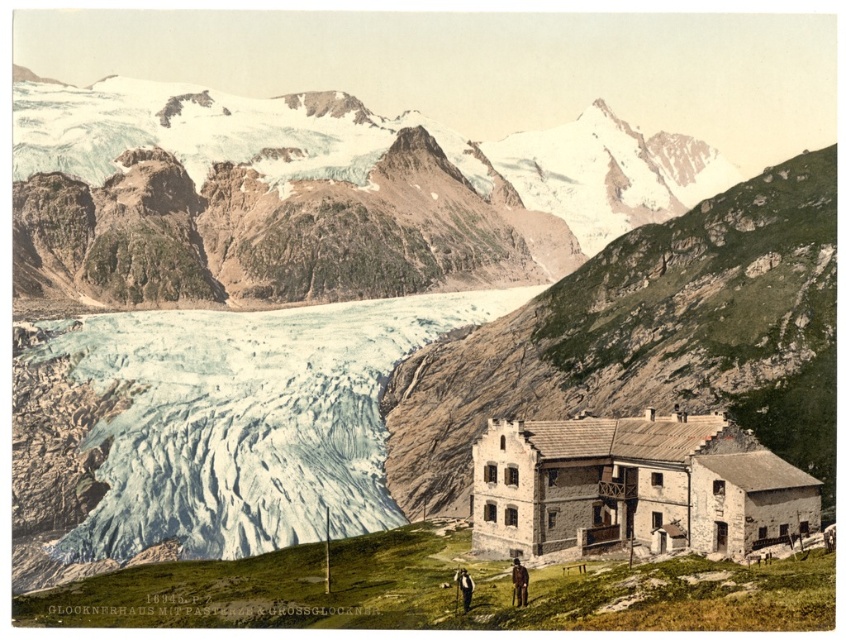
Question: Does snowy rocky mountain at upper center have a larger size compared to dark gray wool jacket at lower center?

Choices:
 (A) yes
 (B) no

Answer: (A)

Question: Which object appears farthest from the camera in this image?

Choices:
 (A) stone textured building at center
 (B) brown leather jacket at lower right

Answer: (A)

Question: Which of the following is the closest to the observer?

Choices:
 (A) (520, 592)
 (B) (567, 371)

Answer: (A)

Question: Which object is farther from the camera taking this photo?

Choices:
 (A) brown leather jacket at lower right
 (B) snowy rocky mountain at upper center
 (C) dark gray wool jacket at lower center
 (D) stone textured building at center

Answer: (B)

Question: Is stone textured building at center closer to the viewer compared to brown leather jacket at lower right?

Choices:
 (A) no
 (B) yes

Answer: (A)

Question: From the image, what is the correct spatial relationship of snowy rocky mountain at upper center in relation to stone textured building at center?

Choices:
 (A) below
 (B) above

Answer: (B)